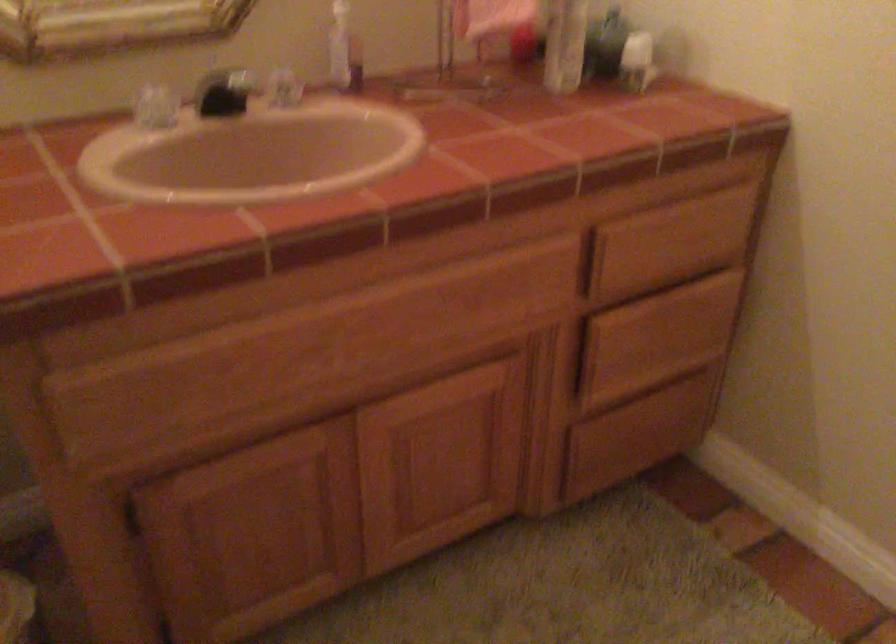
Find where to lift the black faucet handle. Please return your answer as a coordinate pair (x, y).

(225, 91)